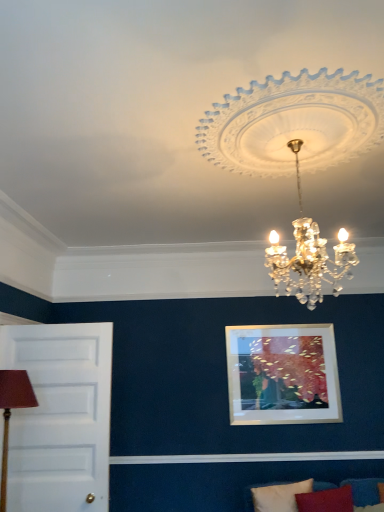
Question: Is white crystal chandelier at upper center closer to the viewer compared to white fabric pillow at lower right?

Choices:
 (A) yes
 (B) no

Answer: (A)

Question: Is white fabric pillow at lower right a part of white crystal chandelier at upper center?

Choices:
 (A) yes
 (B) no

Answer: (B)

Question: Would you consider white crystal chandelier at upper center to be distant from white fabric pillow at lower right?

Choices:
 (A) yes
 (B) no

Answer: (A)

Question: From the image's perspective, is white crystal chandelier at upper center located beneath white fabric pillow at lower right?

Choices:
 (A) no
 (B) yes

Answer: (A)

Question: Can you confirm if white crystal chandelier at upper center is smaller than white fabric pillow at lower right?

Choices:
 (A) yes
 (B) no

Answer: (B)

Question: Considering the positions of white fabric pillow at lower right and white painted wood door at left in the image, is white fabric pillow at lower right taller or shorter than white painted wood door at left?

Choices:
 (A) tall
 (B) short

Answer: (B)

Question: Is point (268, 492) positioned closer to the camera than point (57, 422)?

Choices:
 (A) closer
 (B) farther

Answer: (A)

Question: Is white fabric pillow at lower right in front of or behind white painted wood door at left in the image?

Choices:
 (A) behind
 (B) front

Answer: (B)

Question: Considering the positions of white fabric pillow at lower right and white painted wood door at left in the image, is white fabric pillow at lower right wider or thinner than white painted wood door at left?

Choices:
 (A) thin
 (B) wide

Answer: (B)

Question: In the image, is brown fabric lampshade at left positioned in front of or behind white crystal chandelier at upper center?

Choices:
 (A) behind
 (B) front

Answer: (A)

Question: From the image's perspective, is brown fabric lampshade at left positioned above or below white crystal chandelier at upper center?

Choices:
 (A) above
 (B) below

Answer: (B)

Question: In terms of width, does brown fabric lampshade at left look wider or thinner when compared to white crystal chandelier at upper center?

Choices:
 (A) thin
 (B) wide

Answer: (A)

Question: Is brown fabric lampshade at left taller or shorter than white crystal chandelier at upper center?

Choices:
 (A) tall
 (B) short

Answer: (B)

Question: Is velvet blue couch at lower right taller or shorter than white crystal chandelier at upper center?

Choices:
 (A) short
 (B) tall

Answer: (A)

Question: Looking at their shapes, would you say velvet blue couch at lower right is wider or thinner than white crystal chandelier at upper center?

Choices:
 (A) thin
 (B) wide

Answer: (A)